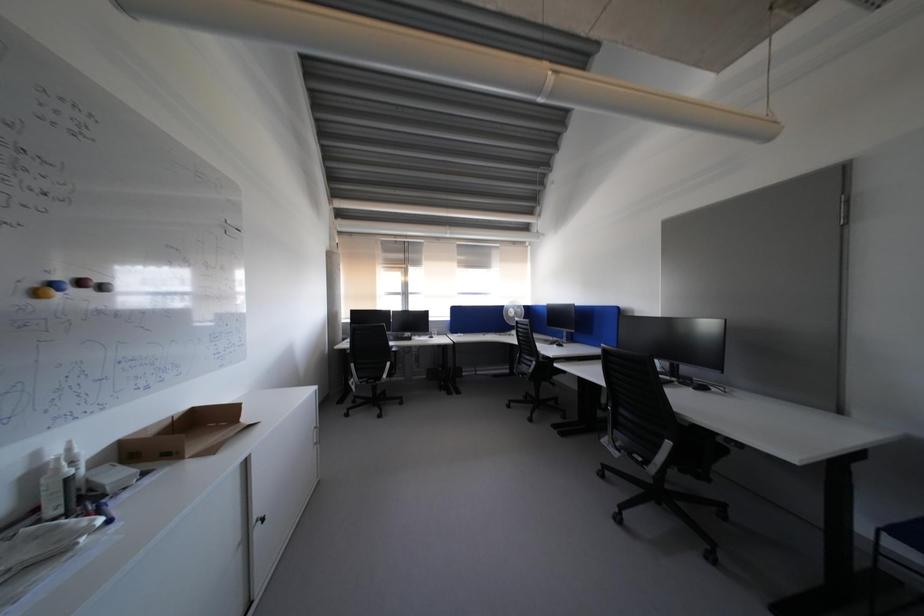
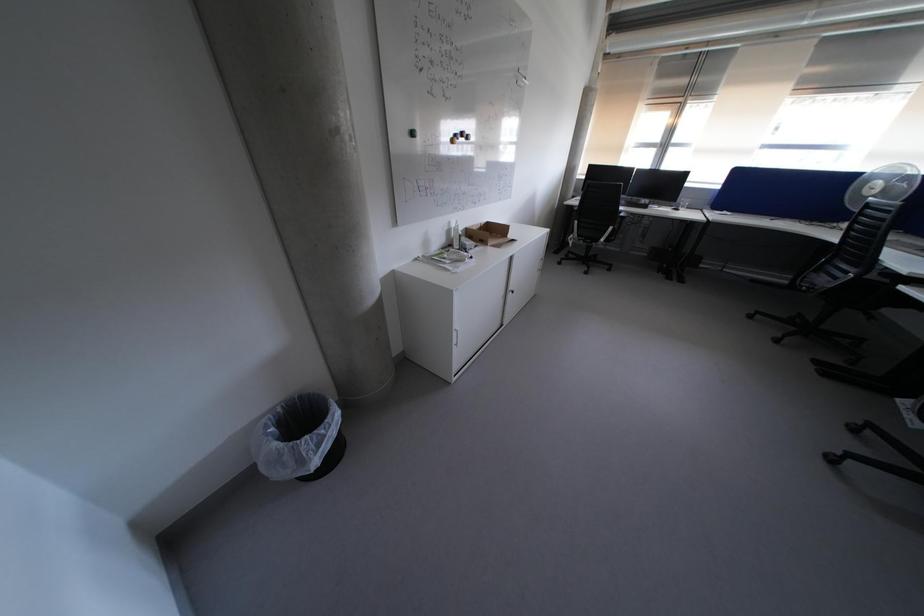
How did the camera likely rotate?

The camera rotated toward left-down.